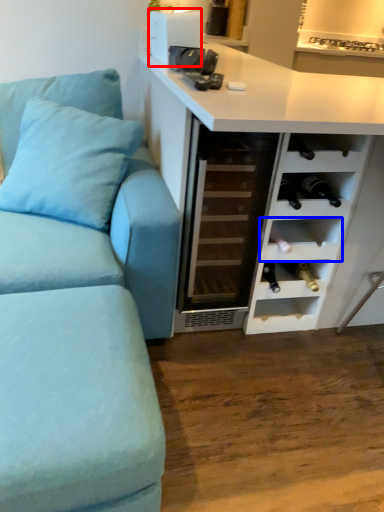
Question: Which object appears farthest to the camera in this image, appliance (highlighted by a red box) or shelf (highlighted by a blue box)?

Choices:
 (A) appliance
 (B) shelf

Answer: (A)